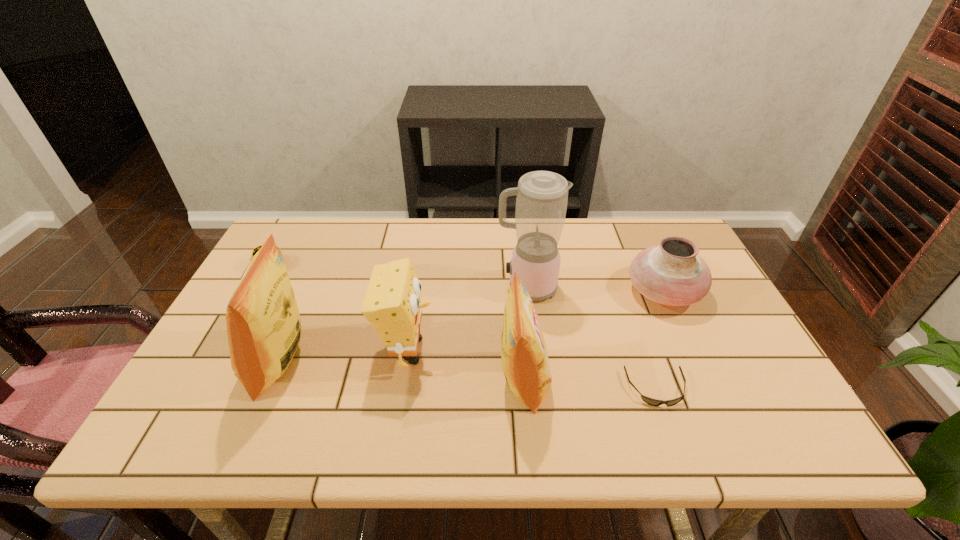
Identify the location of vacant space that satisfies the following two spatial constraints: 1. on the front side of the patty; 2. on the left side of the fifth tallest object. (256, 292).